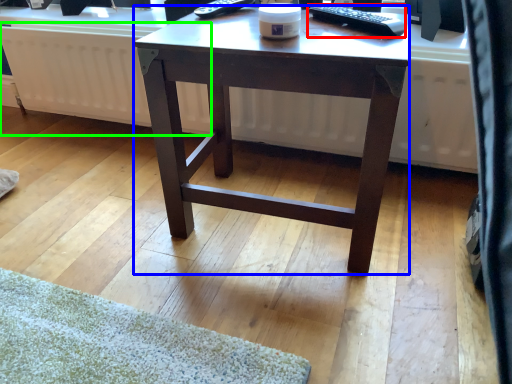
Question: Which is nearer to the remote control (highlighted by a red box)? desk (highlighted by a blue box) or radiator (highlighted by a green box).

Choices:
 (A) desk
 (B) radiator

Answer: (A)